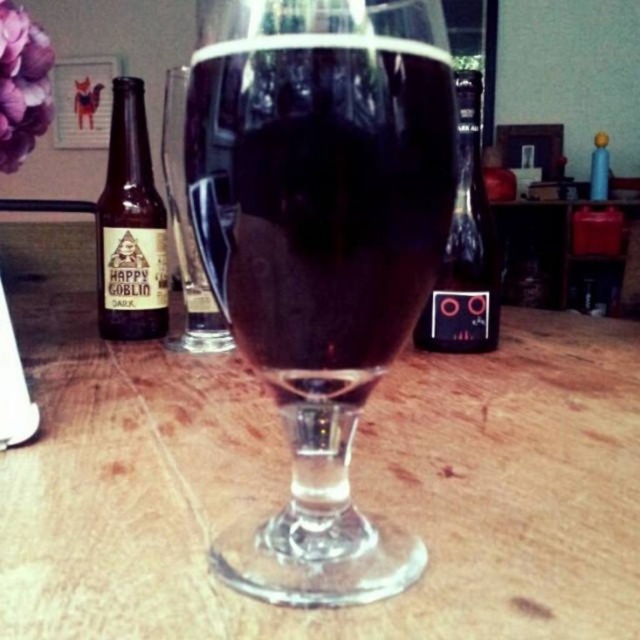
Is point (152, 301) positioned after point (35, 108)?

That is True.

Is brown glass bottle at left positioned before purple matte flower at upper left?

No, brown glass bottle at left is further to the viewer.

Is point (145, 250) positioned behind point (12, 157)?

Yes.

This screenshot has width=640, height=640. Identify the location of brown glass bottle at left. pos(131,227).

Is brown glass bottle at left to the left of black glass bottle at center from the viewer's perspective?

Yes, brown glass bottle at left is to the left of black glass bottle at center.

Is point (164, 305) positioned after point (483, 342)?

That is True.

Where is `brown glass bottle at left`? brown glass bottle at left is located at coordinates (131, 227).

Does black glass bottle at center have a lesser height compared to purple matte flower at upper left?

Incorrect, black glass bottle at center's height does not fall short of purple matte flower at upper left's.

Can you confirm if black glass bottle at center is thinner than purple matte flower at upper left?

No, black glass bottle at center is not thinner than purple matte flower at upper left.

Who is more forward, [490,225] or [19,97]?

Point [19,97] is in front.

The width and height of the screenshot is (640, 640). Identify the location of black glass bottle at center. (465, 246).